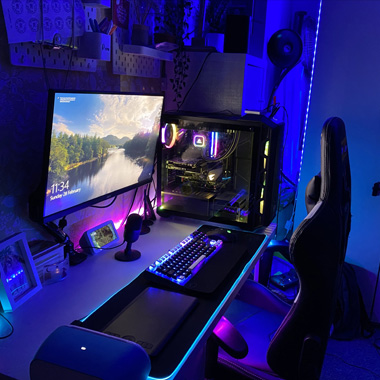
I want to click on pen holder, so click(x=102, y=47).